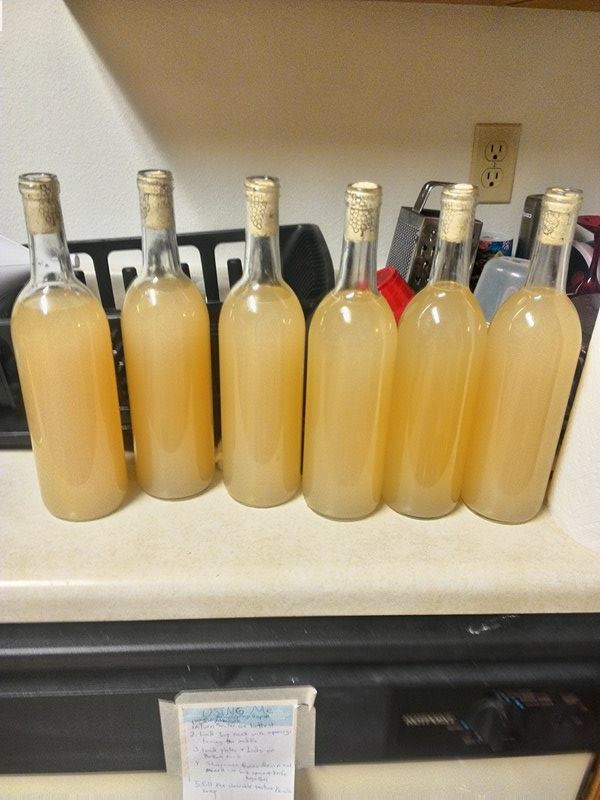
This screenshot has height=800, width=600. What are the coordinates of `washing machine` in the screenshot? It's located at (389, 782).